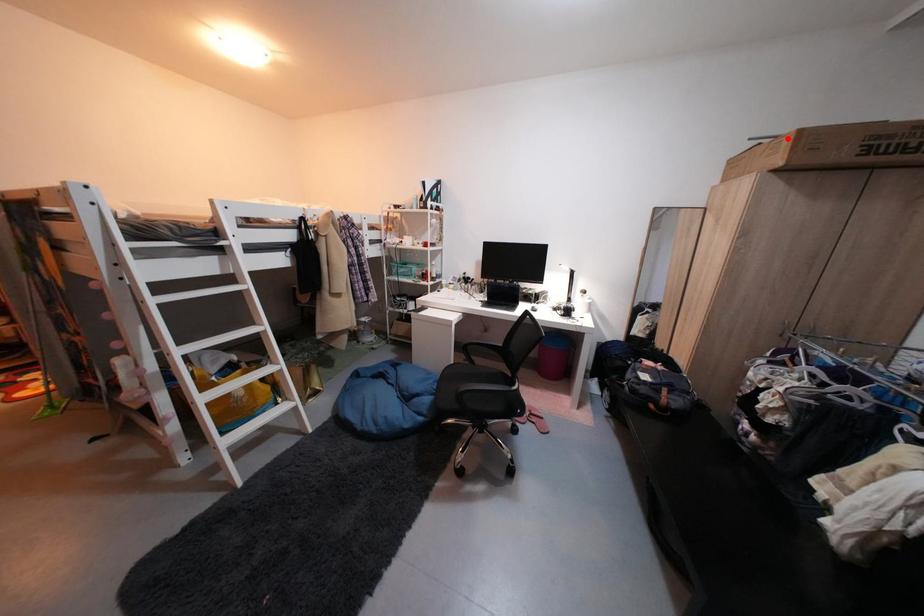
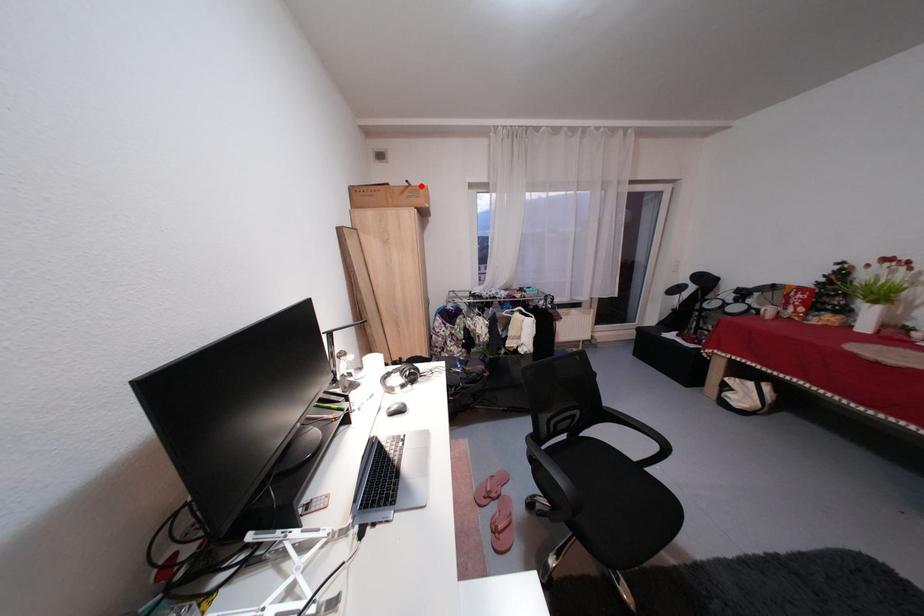
I am providing you with two images of the same scene from different viewpoints. A red point is marked on the first image and another point is marked on the second image. Do the highlighted points in image1 and image2 indicate the same real-world spot?

Yes